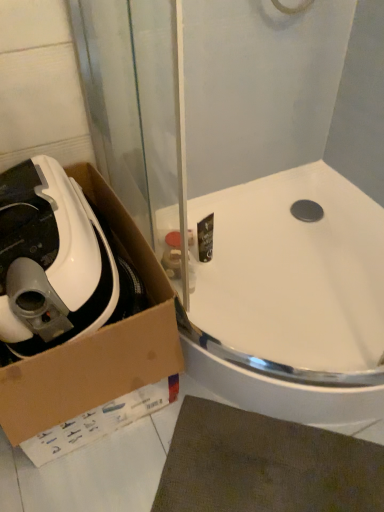
Describe the element at coordinates (96, 343) in the screenshot. The height and width of the screenshot is (512, 384). I see `cardboard box at lower left` at that location.

Where is `white matte vacuum cleaner at left`? The height and width of the screenshot is (512, 384). white matte vacuum cleaner at left is located at coordinates (50, 260).

At what (x,y) coordinates should I click in order to perform the action: click on cardboard box at lower left. Please return your answer as a coordinate pair (x, y). Image resolution: width=384 pixels, height=512 pixels. Looking at the image, I should click on (96, 343).

From a real-world perspective, between white matte vacuum cleaner at left and white glossy sink at upper center, who is vertically higher?

white matte vacuum cleaner at left, from a real-world perspective.

Between white matte vacuum cleaner at left and white glossy sink at upper center, which one appears on the left side from the viewer's perspective?

From the viewer's perspective, white matte vacuum cleaner at left appears more on the left side.

From the image's perspective, is white matte vacuum cleaner at left under white glossy sink at upper center?

Incorrect, from the image's perspective, white matte vacuum cleaner at left is higher than white glossy sink at upper center.

Is white glossy sink at upper center in front of or behind cardboard box at lower left in the image?

Visually, white glossy sink at upper center is located behind cardboard box at lower left.

Is there a large distance between white glossy sink at upper center and cardboard box at lower left?

white glossy sink at upper center is near cardboard box at lower left, not far away.

Is white glossy sink at upper center facing towards cardboard box at lower left?

No, white glossy sink at upper center is not turned towards cardboard box at lower left.

From a real-world perspective, is white matte vacuum cleaner at left located beneath cardboard box at lower left?

Incorrect, from a real-world perspective, white matte vacuum cleaner at left is higher than cardboard box at lower left.

In terms of width, does white matte vacuum cleaner at left look wider or thinner when compared to cardboard box at lower left?

Clearly, white matte vacuum cleaner at left has less width compared to cardboard box at lower left.

Between white matte vacuum cleaner at left and cardboard box at lower left, which one appears on the left side from the viewer's perspective?

white matte vacuum cleaner at left.

Who is taller, white matte vacuum cleaner at left or cardboard box at lower left?

cardboard box at lower left is taller.

Considering the sizes of objects cardboard box at lower left and white matte vacuum cleaner at left in the image provided, who is thinner, cardboard box at lower left or white matte vacuum cleaner at left?

A: white matte vacuum cleaner at left.

Based on the photo, could you tell me if cardboard box at lower left is facing white matte vacuum cleaner at left?

Yes.

This screenshot has width=384, height=512. I want to click on appliance lying above the cardboard box at lower left (from the image's perspective), so click(50, 260).

Relative to white matte vacuum cleaner at left, is cardboard box at lower left in front or behind?

Visually, cardboard box at lower left is located in front of white matte vacuum cleaner at left.

Is cardboard box at lower left shorter than white glossy sink at upper center?

In fact, cardboard box at lower left may be taller than white glossy sink at upper center.

Is white glossy sink at upper center inside cardboard box at lower left?

No, white glossy sink at upper center is not a part of cardboard box at lower left.

Considering the positions of points (92, 357) and (378, 234), is point (92, 357) farther from camera compared to point (378, 234)?

No, it is not.

At what (x,y) coordinates should I click in order to perform the action: click on appliance above the white glossy sink at upper center (from a real-world perspective). Please return your answer as a coordinate pair (x, y). Looking at the image, I should click on (50, 260).

From their relative heights in the image, would you say white glossy sink at upper center is taller or shorter than white matte vacuum cleaner at left?

Clearly, white glossy sink at upper center is shorter compared to white matte vacuum cleaner at left.

In the scene shown: In the image, is white glossy sink at upper center positioned in front of or behind white matte vacuum cleaner at left?

white glossy sink at upper center is behind white matte vacuum cleaner at left.

Can you confirm if white glossy sink at upper center is positioned to the left of white matte vacuum cleaner at left?

No.

Locate an element on the screen. appliance above the white glossy sink at upper center (from a real-world perspective) is located at coordinates (50, 260).

Image resolution: width=384 pixels, height=512 pixels. What are the coordinates of `sink that appears above the cardboard box at lower left (from the image's perspective)` in the screenshot? It's located at (291, 298).

Based on their spatial positions, is white glossy sink at upper center or cardboard box at lower left further from white matte vacuum cleaner at left?

Based on the image, white glossy sink at upper center appears to be further to white matte vacuum cleaner at left.

When comparing their distances from white glossy sink at upper center, does cardboard box at lower left or white matte vacuum cleaner at left seem further?

white matte vacuum cleaner at left lies further to white glossy sink at upper center than the other object.

Estimate the real-world distances between objects in this image. Which object is further from white glossy sink at upper center, white matte vacuum cleaner at left or cardboard box at lower left?

white matte vacuum cleaner at left.

From the image, which object appears to be farther from cardboard box at lower left, white matte vacuum cleaner at left or white glossy sink at upper center?

white glossy sink at upper center lies further to cardboard box at lower left than the other object.

Estimate the real-world distances between objects in this image. Which object is further from white matte vacuum cleaner at left, cardboard box at lower left or white glossy sink at upper center?

The object further to white matte vacuum cleaner at left is white glossy sink at upper center.

Estimate the real-world distances between objects in this image. Which object is further from cardboard box at lower left, white glossy sink at upper center or white matte vacuum cleaner at left?

white glossy sink at upper center is positioned further to the anchor cardboard box at lower left.

Image resolution: width=384 pixels, height=512 pixels. Find the location of `box between white matte vacuum cleaner at left and white glossy sink at upper center from left to right`. box between white matte vacuum cleaner at left and white glossy sink at upper center from left to right is located at coordinates (96, 343).